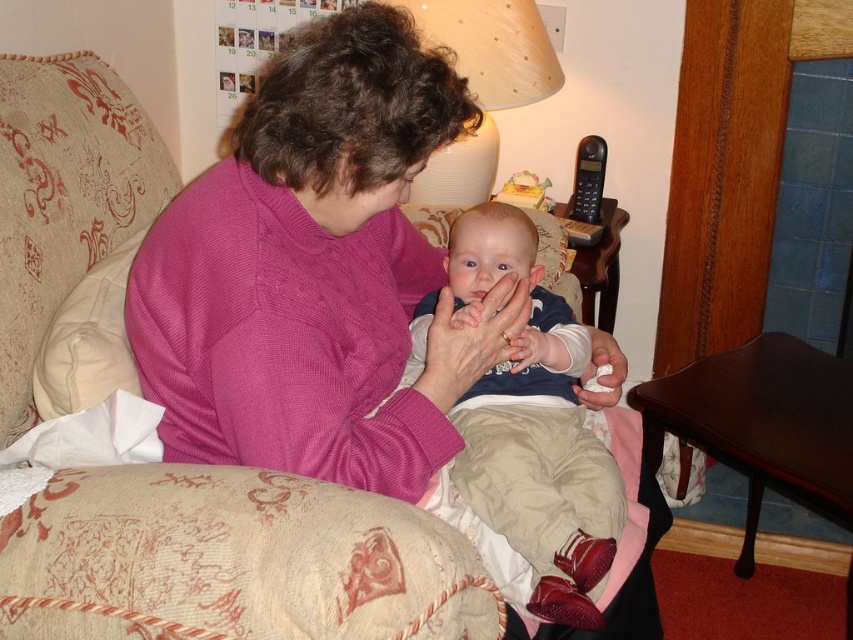
You are a delivery person who needs to place a 24 inch package between the pink knitted sweater at center and the beige fabric lampshade at upper center. Can the package fit in the space between them?

The distance between the pink knitted sweater at center and the beige fabric lampshade at upper center is 23.52 inches. Since the package is 24 inches long, it cannot fit in the space between them as the package is slightly longer than the available distance.

From the picture: You are designing a new clothing line and need to compare the widths of the pink knitted sweater at center and the smooth beige pants at center. Which item is wider?

The pink knitted sweater at center might be wider than smooth beige pants at center.

You are a delivery person who needs to place a 22 inch package between the smooth beige pants at center and the beige fabric lampshade at upper center. Can you fit it between them?

The smooth beige pants at center and the beige fabric lampshade at upper center are 21.98 inches apart, which is slightly less than the 22 inch package. Therefore, the package cannot fit between them.